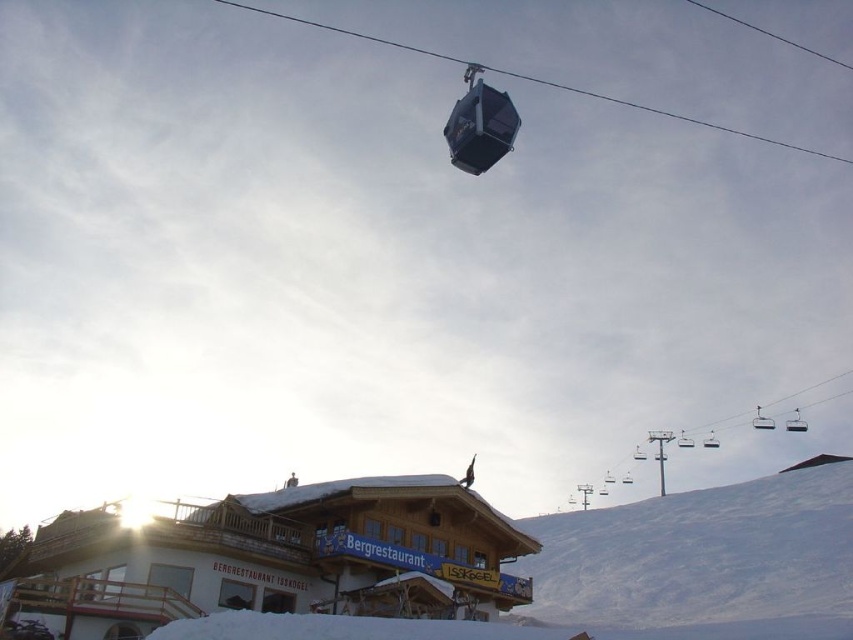
Question: In this image, where is wooden cabin at lower center located relative to white snow at upper right?

Choices:
 (A) above
 (B) below

Answer: (A)

Question: Which point is farther to the camera?

Choices:
 (A) (350, 492)
 (B) (833, 552)

Answer: (B)

Question: Can you confirm if wooden cabin at lower center is positioned below white snow at upper right?

Choices:
 (A) yes
 (B) no

Answer: (B)

Question: Can you confirm if wooden cabin at lower center is positioned to the left of white snow at upper right?

Choices:
 (A) yes
 (B) no

Answer: (A)

Question: Which of the following is the closest to the observer?

Choices:
 (A) (62, 602)
 (B) (701, 554)

Answer: (A)

Question: Among these objects, which one is nearest to the camera?

Choices:
 (A) white snow at upper right
 (B) wooden cabin at lower center

Answer: (B)